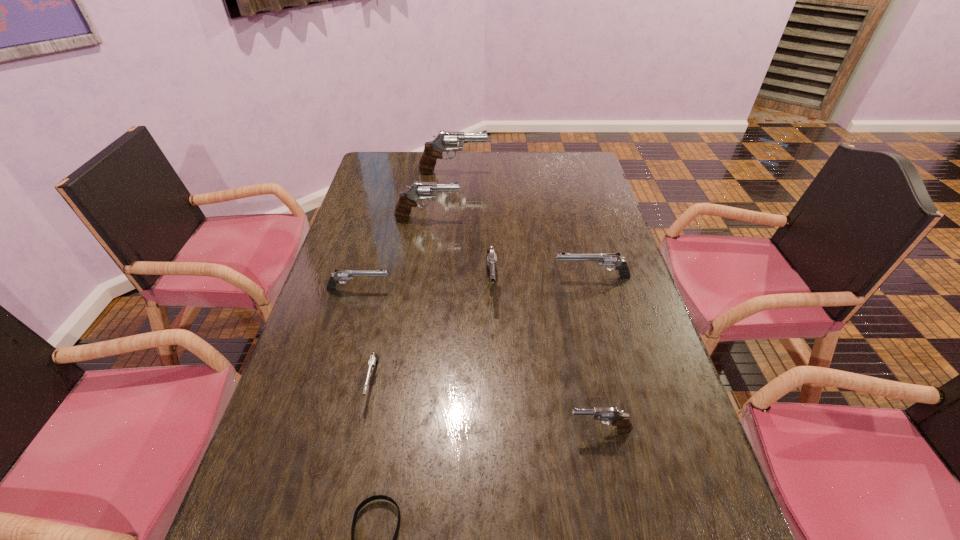
The image size is (960, 540). I want to click on unoccupied area between the biggest gray pistol and the farthest silver pistol, so click(x=522, y=225).

At what (x,y) coordinates should I click in order to perform the action: click on unoccupied area between the third farthest gray pistol and the rightmost silver pistol. Please return your answer as a coordinate pair (x, y). The height and width of the screenshot is (540, 960). Looking at the image, I should click on (541, 280).

Identify the location of free point between the second farthest silver pistol and the third tallest pistol. (425, 286).

At what (x,y) coordinates should I click in order to perform the action: click on free space between the third biggest gray pistol and the farthest silver pistol. Please return your answer as a coordinate pair (x, y). Looking at the image, I should click on (541, 280).

Find the location of a particular element. This screenshot has height=540, width=960. free spot between the nearest gray pistol and the second farthest pistol is located at coordinates (514, 324).

The width and height of the screenshot is (960, 540). In order to click on free space that is in between the farthest gray pistol and the second farthest pistol in this screenshot , I will do `click(440, 195)`.

Find the location of `vacant space that's between the biggest silver pistol and the second tallest object`. vacant space that's between the biggest silver pistol and the second tallest object is located at coordinates (510, 248).

Locate an element on the screen. This screenshot has height=540, width=960. empty space that is in between the farthest object and the second farthest gray pistol is located at coordinates (440, 195).

Identify the location of object that is the second closest to the second tallest object. (433, 150).

Identify which object is located as the seventh nearest to the smallest gray pistol. Please provide its 2D coordinates. Your answer should be formatted as a tuple, i.e. [(x, y)], where the tuple contains the x and y coordinates of a point satisfying the conditions above.

[(433, 150)]